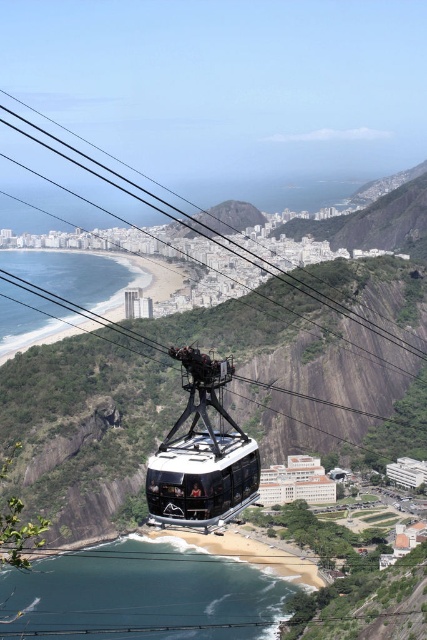
Does shiny black cable car at center have a greater width compared to green rock at center?

No, shiny black cable car at center is not wider than green rock at center.

Does shiny black cable car at center have a greater height compared to green rock at center?

Correct, shiny black cable car at center is much taller as green rock at center.

Does point (161, 452) come farther from viewer compared to point (240, 209)?

No.

Where is `shiny black cable car at center`? Image resolution: width=427 pixels, height=640 pixels. shiny black cable car at center is located at coordinates (201, 452).